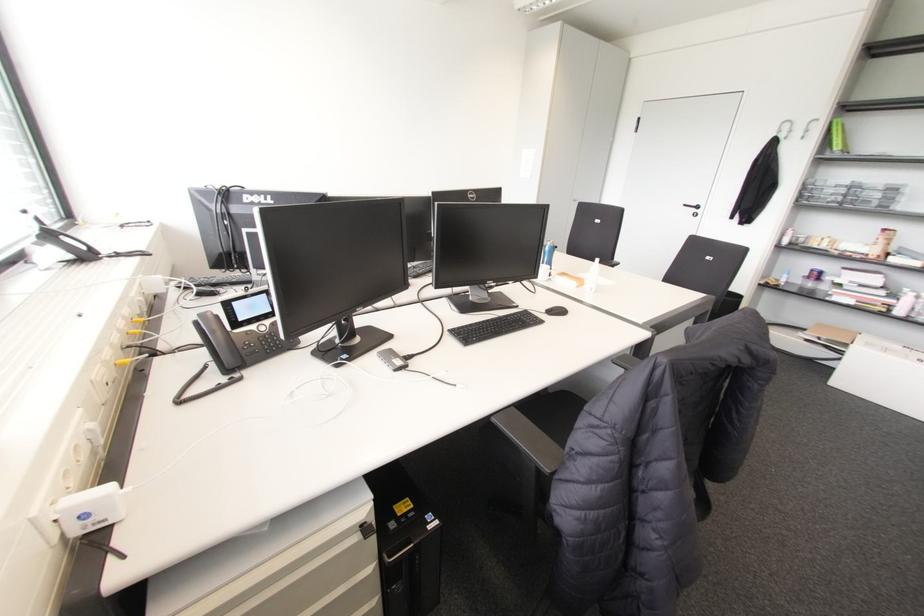
Where would you hang the metal wall hook? Please return your answer as a coordinate pair (x, y).

(808, 128)